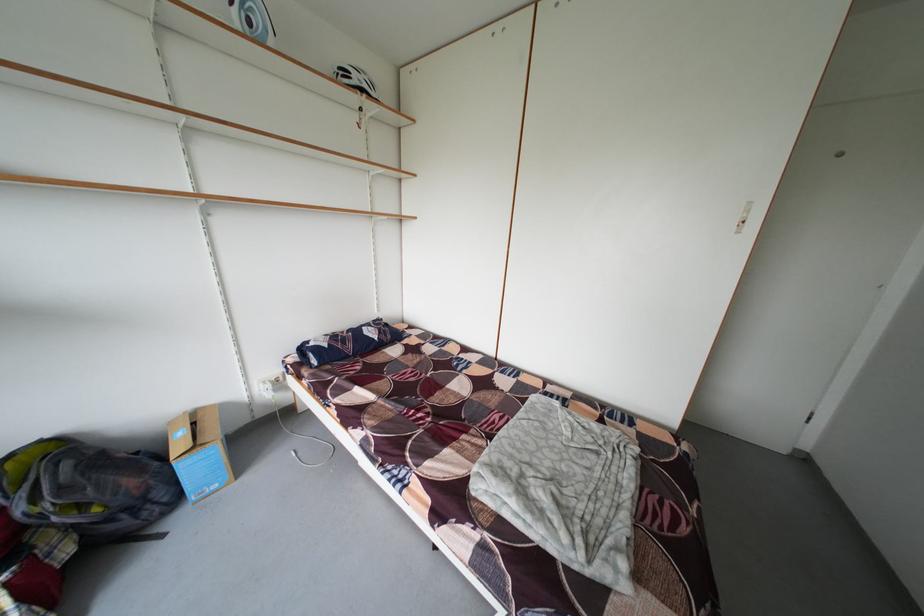
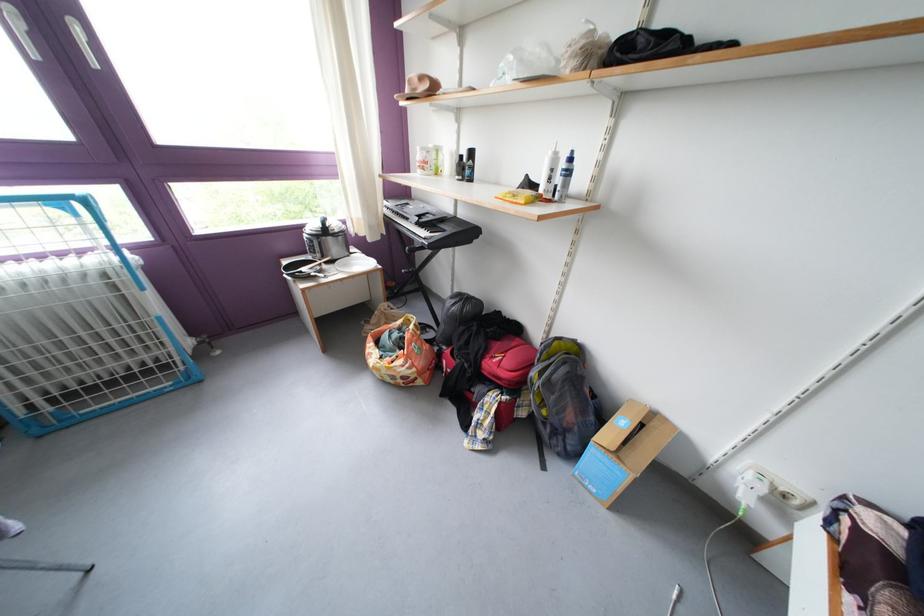
The point at (265, 387) is marked in the first image. Where is the corresponding point in the second image?

(758, 467)